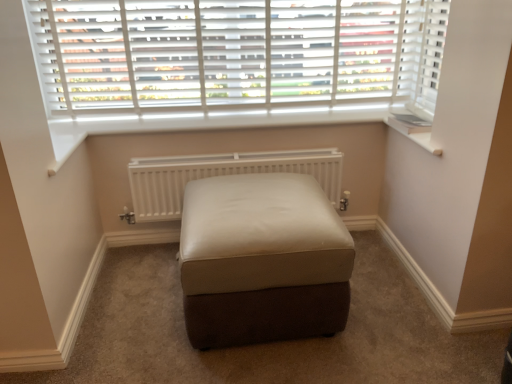
Where is `white matte radiator at center`? The width and height of the screenshot is (512, 384). white matte radiator at center is located at coordinates (221, 175).

The height and width of the screenshot is (384, 512). Describe the element at coordinates (415, 134) in the screenshot. I see `white plastic window sill at upper right` at that location.

Find the location of `white wood blinds at upper center`. white wood blinds at upper center is located at coordinates (237, 56).

What do you see at coordinates (262, 260) in the screenshot?
I see `leather ottoman at center` at bounding box center [262, 260].

In order to face leather ottoman at center, should I rotate leftwards or rightwards?

You should look left and rotate roughly 0.019 degrees.

At what (x,y) coordinates should I click in order to perform the action: click on white matte radiator at center. Please return your answer as a coordinate pair (x, y). Looking at the image, I should click on tap(221, 175).

Is white matte radiator at center shorter than white plastic window sill at upper right?

Incorrect, the height of white matte radiator at center does not fall short of that of white plastic window sill at upper right.

Is white matte radiator at center facing towards white plastic window sill at upper right?

No, white matte radiator at center is not turned towards white plastic window sill at upper right.

How many degrees apart are the facing directions of white matte radiator at center and white plastic window sill at upper right?

They differ by 0.0639 degrees in their facing directions.

Is white wood blinds at upper center in front of or behind white matte radiator at center in the image?

white wood blinds at upper center is positioned closer to the viewer than white matte radiator at center.

Considering the relative sizes of white wood blinds at upper center and white matte radiator at center in the image provided, is white wood blinds at upper center bigger than white matte radiator at center?

Yes, white wood blinds at upper center is bigger than white matte radiator at center.

Image resolution: width=512 pixels, height=384 pixels. What are the coordinates of `window to the left of white matte radiator at center` in the screenshot? It's located at (237, 56).

Can you tell me how much white wood blinds at upper center and white matte radiator at center differ in facing direction?

There is a 0.0642-degree angle between the facing directions of white wood blinds at upper center and white matte radiator at center.

Is white plastic window sill at upper right in front of or behind white wood blinds at upper center in the image?

white plastic window sill at upper right is positioned closer to the viewer than white wood blinds at upper center.

Does white plastic window sill at upper right have a lesser width compared to white wood blinds at upper center?

No, white plastic window sill at upper right is not thinner than white wood blinds at upper center.

Between point (422, 142) and point (303, 13), which one is positioned behind?

The point (303, 13) is farther from the camera.

Considering the sizes of white plastic window sill at upper right and white wood blinds at upper center in the image, is white plastic window sill at upper right taller or shorter than white wood blinds at upper center?

In the image, white plastic window sill at upper right appears to be shorter than white wood blinds at upper center.

From a real-world perspective, which object rests below the other?

white matte radiator at center, from a real-world perspective.

Can white wood blinds at upper center be found inside white matte radiator at center?

No, white wood blinds at upper center is not surrounded by white matte radiator at center.

Which is behind, point (324, 179) or point (272, 67)?

Positioned behind is point (324, 179).

Does point (392, 123) come closer to viewer compared to point (234, 165)?

No.

The image size is (512, 384). Identify the location of window sill to the right of white matte radiator at center. (415, 134).

In the scene shown: Measure the distance between white plastic window sill at upper right and white matte radiator at center.

A distance of 26.92 inches exists between white plastic window sill at upper right and white matte radiator at center.

Consider the image. Who is bigger, white plastic window sill at upper right or white matte radiator at center?

white matte radiator at center.

From a real-world perspective, which is physically below, white wood blinds at upper center or leather ottoman at center?

leather ottoman at center, from a real-world perspective.

Looking at this image, is white wood blinds at upper center turned away from leather ottoman at center?

No, white wood blinds at upper center's orientation is not away from leather ottoman at center.

From the image's perspective, which one is positioned higher, white wood blinds at upper center or leather ottoman at center?

white wood blinds at upper center appears higher in the image.

Could you tell me if leather ottoman at center is turned towards white plastic window sill at upper right?

No, leather ottoman at center is not facing towards white plastic window sill at upper right.

Which point is more distant from viewer, (225, 303) or (383, 119)?

The point (383, 119) is behind.

Is leather ottoman at center outside of white plastic window sill at upper right?

leather ottoman at center is positioned outside white plastic window sill at upper right.

At what (x,y) coordinates should I click in order to perform the action: click on radiator below the white plastic window sill at upper right (from the image's perspective). Please return your answer as a coordinate pair (x, y). This screenshot has height=384, width=512. Looking at the image, I should click on (221, 175).

Where is `radiator directly beneath the white wood blinds at upper center (from a real-world perspective)`? This screenshot has height=384, width=512. radiator directly beneath the white wood blinds at upper center (from a real-world perspective) is located at coordinates (221, 175).

From the image, which object appears to be farther from white matte radiator at center, leather ottoman at center or white plastic window sill at upper right?

Based on the image, white plastic window sill at upper right appears to be further to white matte radiator at center.

Considering their positions, is leather ottoman at center positioned further to white matte radiator at center than white wood blinds at upper center?

Among the two, leather ottoman at center is located further to white matte radiator at center.

From the picture: Which object lies further to the anchor point white matte radiator at center, white wood blinds at upper center or white plastic window sill at upper right?

Based on the image, white plastic window sill at upper right appears to be further to white matte radiator at center.

Estimate the real-world distances between objects in this image. Which object is further from white wood blinds at upper center, leather ottoman at center or white plastic window sill at upper right?

leather ottoman at center.

Considering their positions, is white plastic window sill at upper right positioned closer to white wood blinds at upper center than white matte radiator at center?

white matte radiator at center.

Estimate the real-world distances between objects in this image. Which object is further from white plastic window sill at upper right, white matte radiator at center or white wood blinds at upper center?

white wood blinds at upper center lies further to white plastic window sill at upper right than the other object.

From the image, which object appears to be nearer to leather ottoman at center, white plastic window sill at upper right or white wood blinds at upper center?

The object closer to leather ottoman at center is white plastic window sill at upper right.

Based on their spatial positions, is white matte radiator at center or leather ottoman at center further from white plastic window sill at upper right?

Among the two, leather ottoman at center is located further to white plastic window sill at upper right.

Locate an element on the screen. The height and width of the screenshot is (384, 512). furniture between white matte radiator at center and white plastic window sill at upper right from left to right is located at coordinates (262, 260).

Image resolution: width=512 pixels, height=384 pixels. In order to click on furniture situated between white wood blinds at upper center and white plastic window sill at upper right from left to right in this screenshot , I will do `click(262, 260)`.

The width and height of the screenshot is (512, 384). I want to click on radiator between white wood blinds at upper center and leather ottoman at center from top to bottom, so click(221, 175).

The height and width of the screenshot is (384, 512). In order to click on radiator between white wood blinds at upper center and white plastic window sill at upper right from left to right in this screenshot , I will do (x=221, y=175).